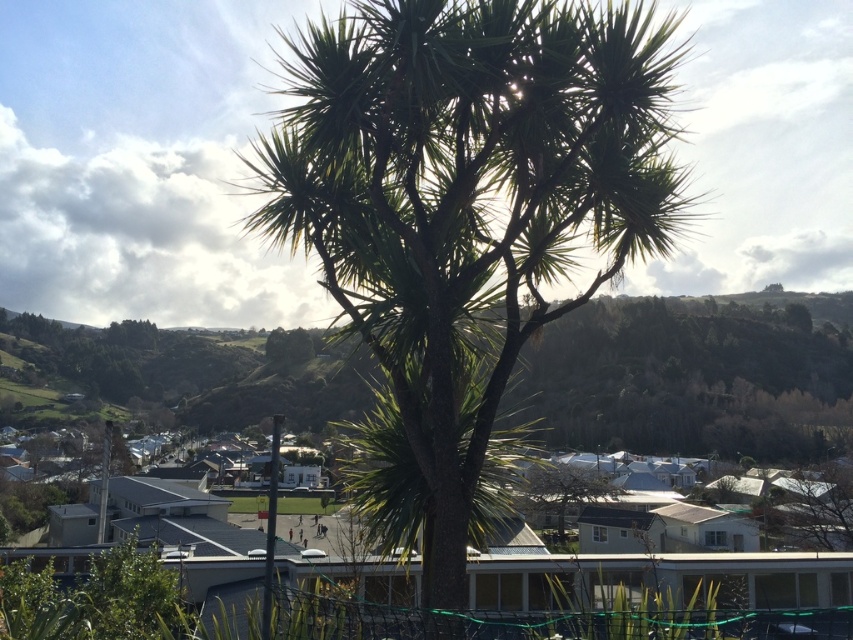
Question: Does green leafy palm tree at center have a larger size compared to green leafy tree at center?

Choices:
 (A) yes
 (B) no

Answer: (B)

Question: Does green leafy palm tree at center appear on the right side of green leafy tree at center?

Choices:
 (A) no
 (B) yes

Answer: (A)

Question: Which object is closer to the camera taking this photo?

Choices:
 (A) green leafy palm tree at center
 (B) green leafy tree at center

Answer: (A)

Question: Can you confirm if green leafy palm tree at center is thinner than green leafy tree at center?

Choices:
 (A) no
 (B) yes

Answer: (B)